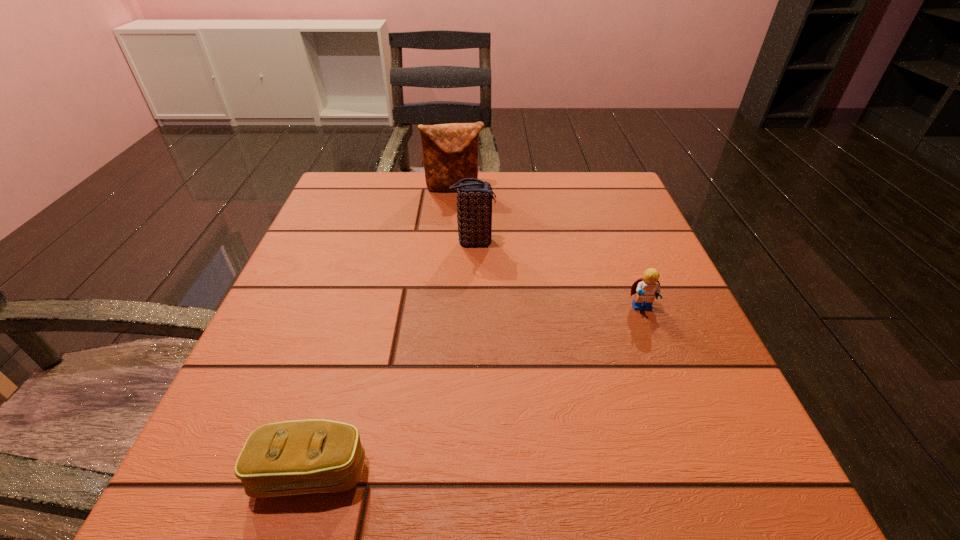
You are a GUI agent. You are given a task and a screenshot of the screen. Output one action in this format:
    pyautogui.click(x=<x>, y=<y>)
    Task: Click on the free space between the leftmost clutch bag and the farthest object
    The image size is (960, 540).
    Given the screenshot: What is the action you would take?
    pyautogui.click(x=383, y=330)

The image size is (960, 540). In order to click on empty space that is in between the second farthest object and the rightmost object in this screenshot , I will do `click(558, 275)`.

The height and width of the screenshot is (540, 960). I want to click on unoccupied area between the farthest object and the Lego, so click(548, 248).

The image size is (960, 540). What are the coordinates of `vacant area that lies between the leftmost clutch bag and the second farthest clutch bag` in the screenshot? It's located at (393, 357).

Find the location of a particular element. Image resolution: width=960 pixels, height=540 pixels. vacant area that lies between the farthest object and the Lego is located at coordinates (548, 248).

At what (x,y) coordinates should I click in order to perform the action: click on free space between the farthest clutch bag and the nearest clutch bag. Please return your answer as a coordinate pair (x, y). The height and width of the screenshot is (540, 960). Looking at the image, I should click on (383, 330).

Where is `free space between the Lego and the leftmost object`? free space between the Lego and the leftmost object is located at coordinates (477, 390).

Where is `free space between the third nearest object and the Lego`? This screenshot has width=960, height=540. free space between the third nearest object and the Lego is located at coordinates (558, 275).

You are a GUI agent. You are given a task and a screenshot of the screen. Output one action in this format:
    pyautogui.click(x=<x>, y=<y>)
    Task: Click on the third closest object to the shortest clutch bag
    
    Given the screenshot: What is the action you would take?
    pyautogui.click(x=450, y=151)

At what (x,y) coordinates should I click in order to perform the action: click on object identified as the closest to the second nearest object. Please return your answer as a coordinate pair (x, y). Image resolution: width=960 pixels, height=540 pixels. Looking at the image, I should click on [x=474, y=199].